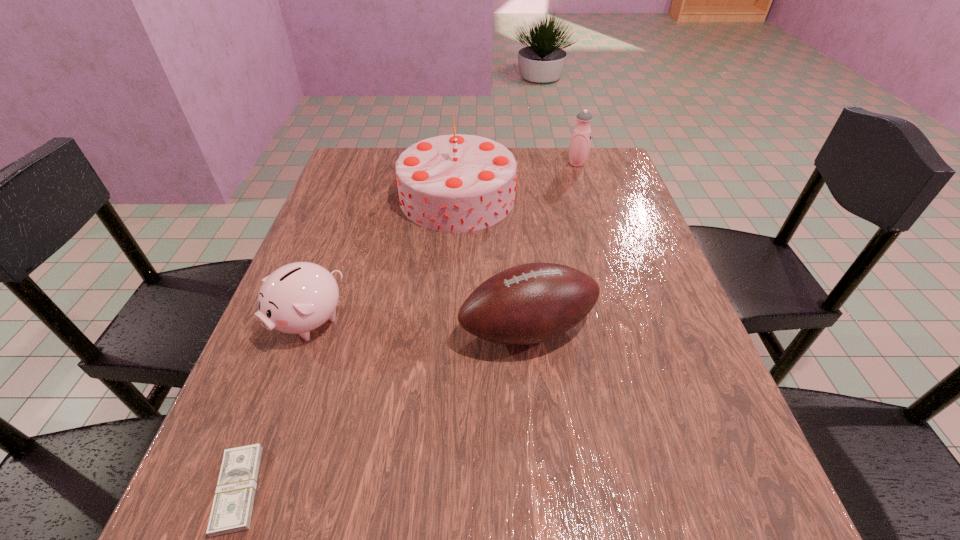
Locate an element on the screen. the tallest object is located at coordinates (456, 183).

Locate an element on the screen. thermos bottle is located at coordinates (x=579, y=147).

Find the location of a particular element. football (American) is located at coordinates (531, 303).

Locate an element on the screen. piggy bank is located at coordinates (299, 297).

Locate an element on the screen. Image resolution: width=960 pixels, height=540 pixels. money is located at coordinates (231, 512).

At what (x,y) coordinates should I click in order to perform the action: click on the nearest object. Please return your answer as a coordinate pair (x, y). The image size is (960, 540). Looking at the image, I should click on (231, 512).

At what (x,y) coordinates should I click in order to perform the action: click on vacant space located 0.290m on the front of the tallest object. Please return your answer as a coordinate pair (x, y). Looking at the image, I should click on (448, 328).

Where is `free space located on the front of the thermos bottle`? Image resolution: width=960 pixels, height=540 pixels. free space located on the front of the thermos bottle is located at coordinates (601, 241).

You are a GUI agent. You are given a task and a screenshot of the screen. Output one action in this format:
    pyautogui.click(x=<x>, y=<y>)
    Task: Click on the vacant space located on the left of the football (American)
    
    Given the screenshot: What is the action you would take?
    pyautogui.click(x=392, y=329)

Where is `free spot located 0.200m on the back of the piggy bank`? This screenshot has width=960, height=540. free spot located 0.200m on the back of the piggy bank is located at coordinates (341, 234).